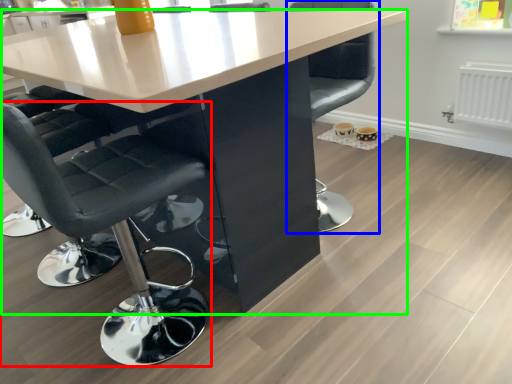
Question: Considering the real-world distances, which object is farthest from chair (highlighted by a red box)? chair (highlighted by a blue box) or table (highlighted by a green box)?

Choices:
 (A) chair
 (B) table

Answer: (A)